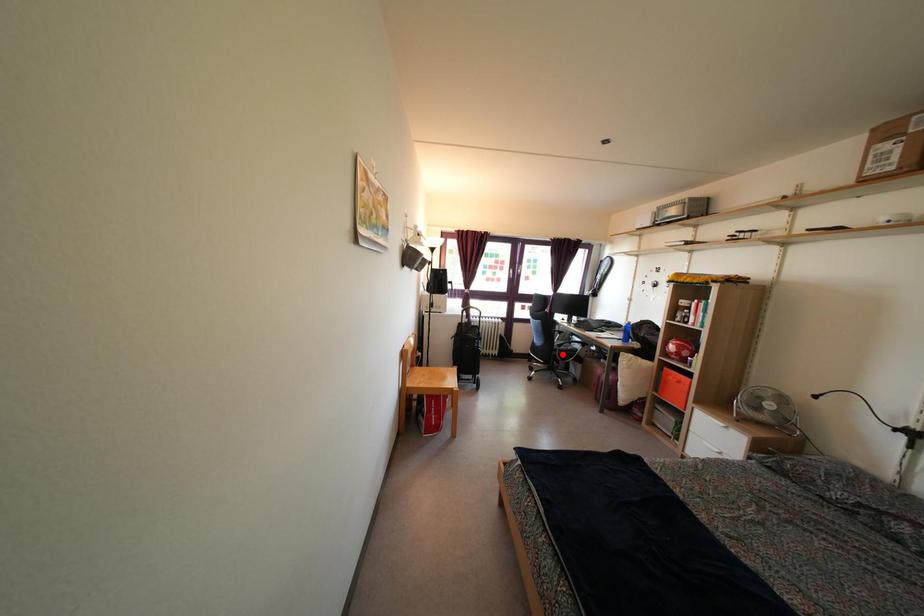
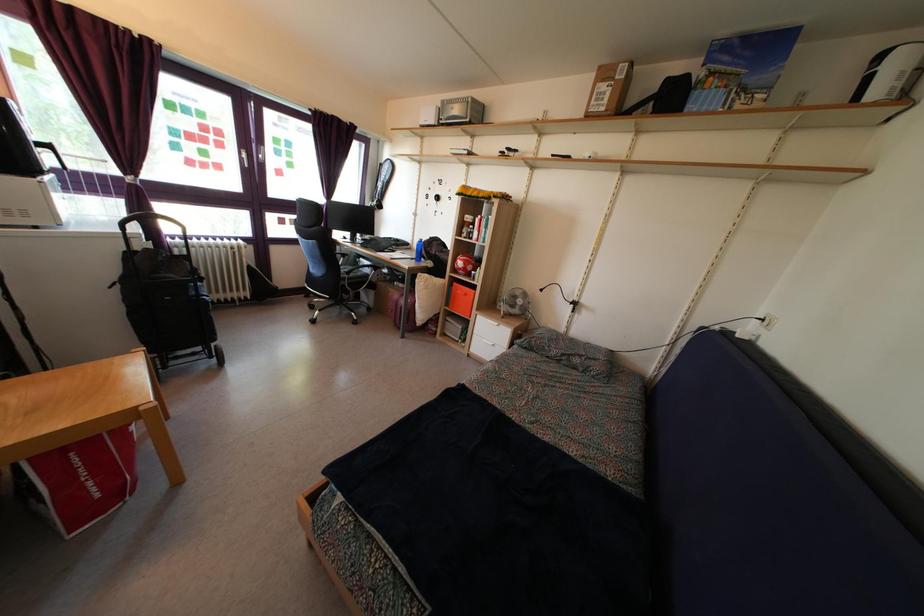
Locate, in the second image, the point that corresponds to the highlighted location in the first image.

(350, 282)